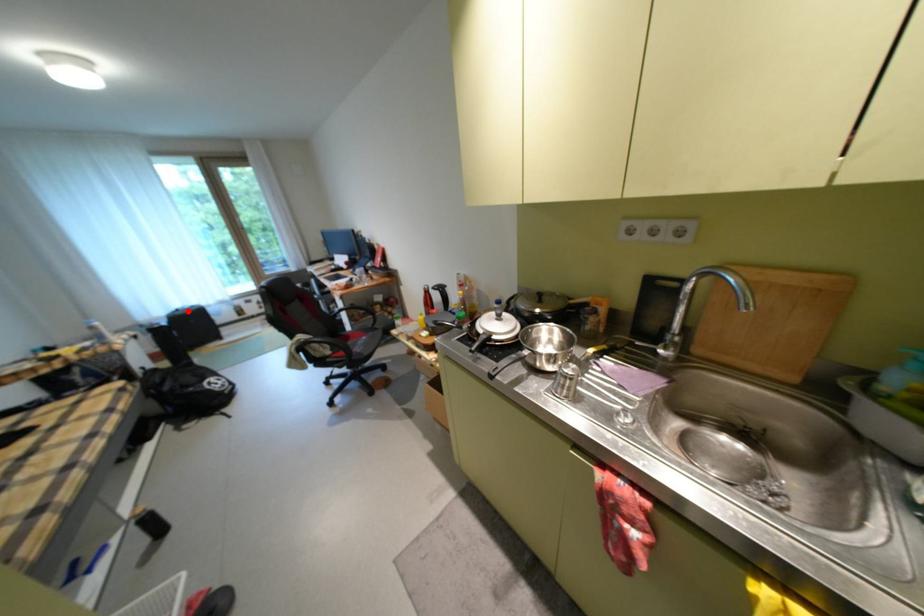
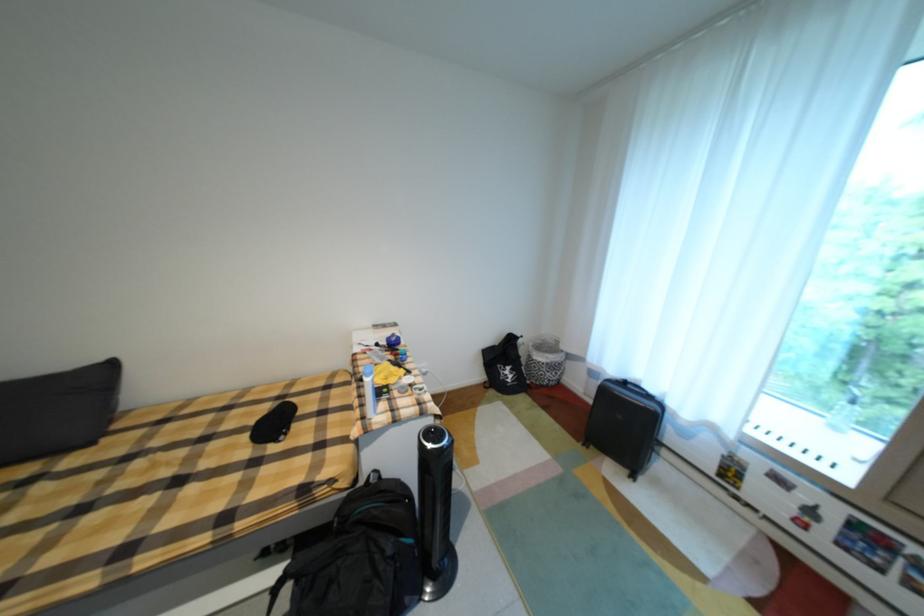
Question: I am providing you with two images of the same scene from different viewpoints. Image1 has a red point marked. In image2, the corresponding 3D location appears at what relative position? Reply with the corresponding letter.

Choices:
 (A) Closer
 (B) Farther

Answer: (B)